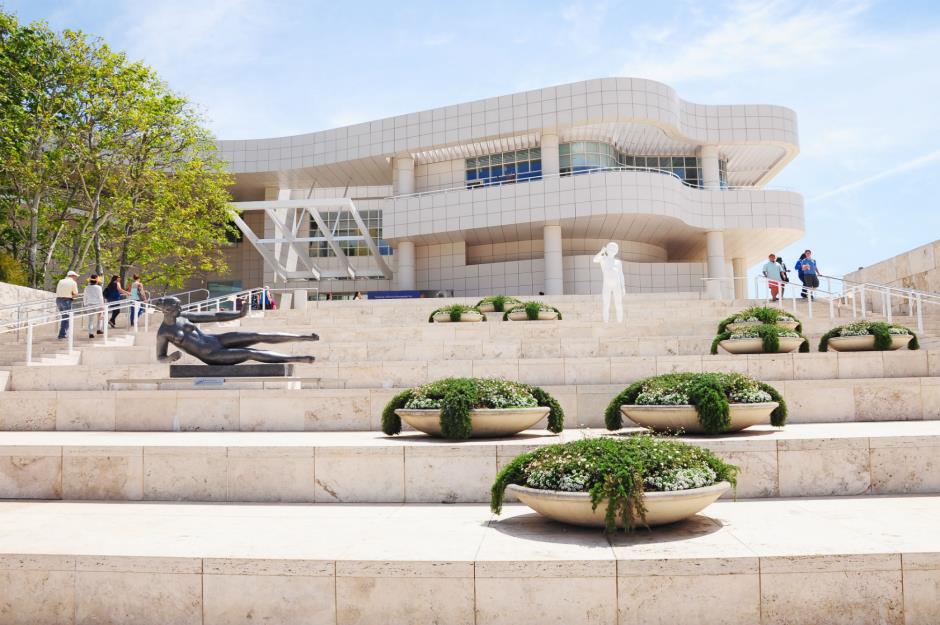
The height and width of the screenshot is (625, 940). In order to click on edge of lowest marble step in foreground in this screenshot , I will do `click(55, 594)`, `click(124, 588)`, `click(249, 598)`, `click(525, 592)`, `click(714, 592)`, `click(822, 585)`, `click(920, 586)`.